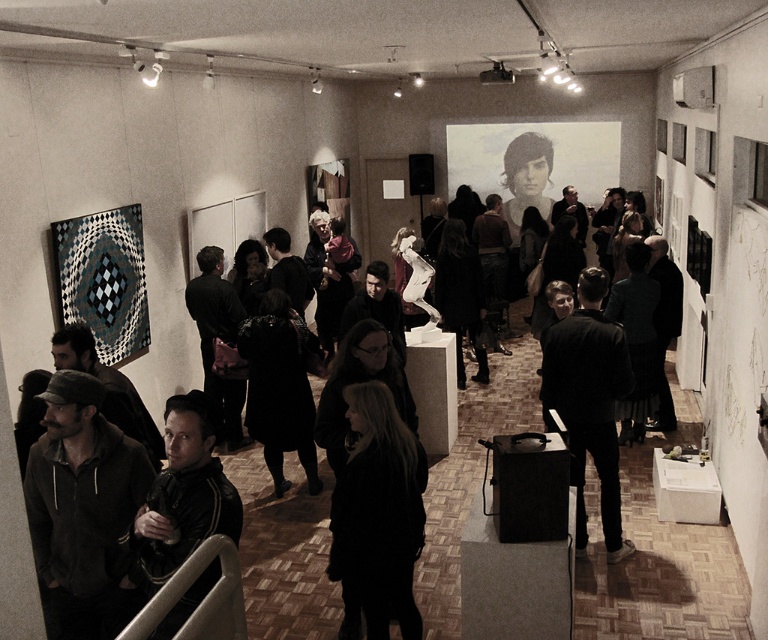
Is point (111, 573) closer to viewer compared to point (184, 481)?

No, it is not.

Measure the distance between dark brown suede jacket at lower left and camera.

dark brown suede jacket at lower left and camera are 2.58 meters apart from each other.

The image size is (768, 640). Identify the location of dark brown suede jacket at lower left. (83, 509).

This screenshot has height=640, width=768. What do you see at coordinates (588, 401) in the screenshot?
I see `black leather jacket at center` at bounding box center [588, 401].

Can you confirm if black leather jacket at center is smaller than black leather jacket at lower left?

No.

Which is in front, point (588, 436) or point (170, 566)?

Point (170, 566) is in front.

Locate an element on the screen. The width and height of the screenshot is (768, 640). black leather jacket at center is located at coordinates (588, 401).

Can you confirm if dark wool coat at center is bigger than black leather jacket at lower left?

No.

Does dark wool coat at center lie in front of black leather jacket at lower left?

That is False.

You are a GUI agent. You are given a task and a screenshot of the screen. Output one action in this format:
    pyautogui.click(x=<x>, y=<y>)
    Task: Click on the dark wool coat at center
    This screenshot has height=640, width=768.
    Given the screenshot: What is the action you would take?
    pyautogui.click(x=378, y=513)

The image size is (768, 640). In order to click on dark wool coat at center in this screenshot , I will do `click(378, 513)`.